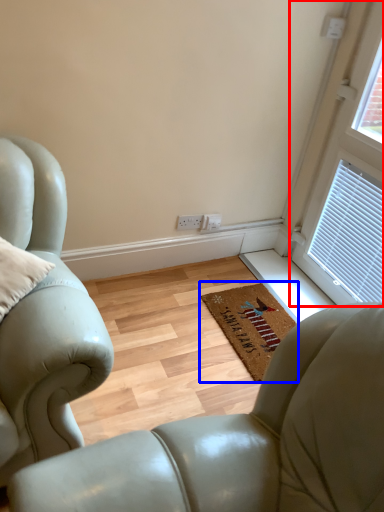
Question: Which object is closer to the camera taking this photo, window (highlighted by a red box) or mat (highlighted by a blue box)?

Choices:
 (A) window
 (B) mat

Answer: (A)